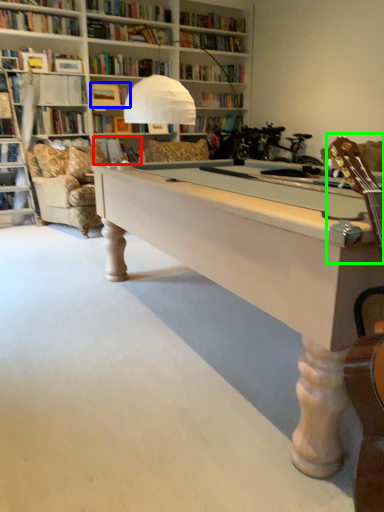
Question: Which is nearer to the book (highlighted by a red box)? book (highlighted by a blue box) or guitar (highlighted by a green box).

Choices:
 (A) book
 (B) guitar

Answer: (A)